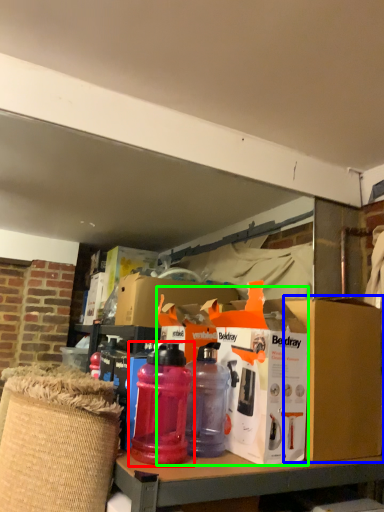
Question: Which is farther away from bottle (highlighted by a red box)? cardboard box (highlighted by a blue box) or box (highlighted by a green box)?

Choices:
 (A) cardboard box
 (B) box

Answer: (A)